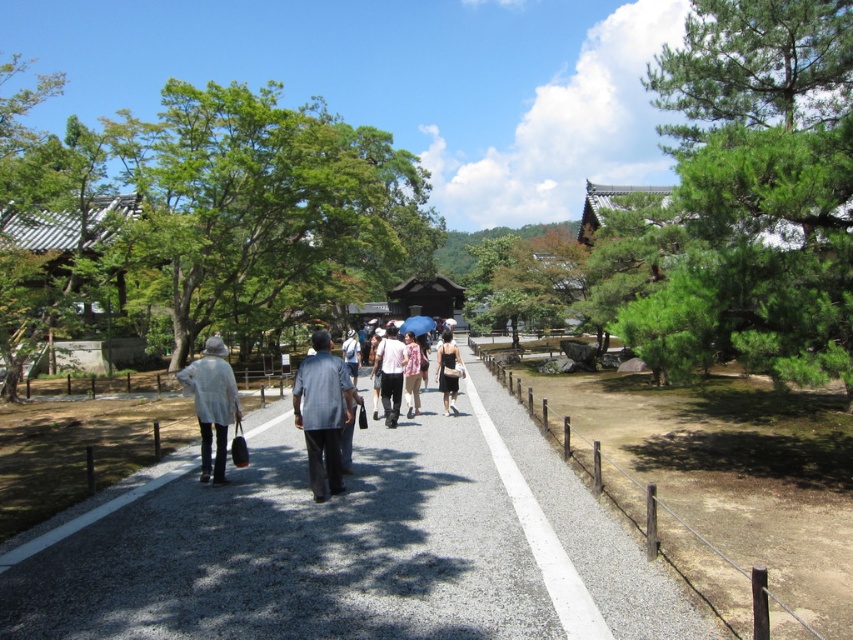
Who is higher up, black satin dress at center or blue fabric umbrella at center?

blue fabric umbrella at center

Is point (447, 376) closer to camera compared to point (428, 323)?

Yes.

Between point (454, 346) and point (419, 316), which one is positioned behind?

The point (419, 316) is more distant.

You are a GUI agent. You are given a task and a screenshot of the screen. Output one action in this format:
    pyautogui.click(x=<x>, y=<y>)
    Task: Click on the black satin dress at center
    
    Given the screenshot: What is the action you would take?
    pyautogui.click(x=447, y=371)

Which is in front, point (743, 317) or point (347, 356)?

Point (743, 317) is in front.

Who is higher up, green textured tree at upper right or light blue denim shirt at center?

Positioned higher is green textured tree at upper right.

What do you see at coordinates (746, 196) in the screenshot?
I see `green textured tree at upper right` at bounding box center [746, 196].

You are a GUI agent. You are given a task and a screenshot of the screen. Output one action in this format:
    pyautogui.click(x=<x>, y=<y>)
    Task: Click on the green textured tree at upper right
    The image size is (853, 640).
    Given the screenshot: What is the action you would take?
    pyautogui.click(x=746, y=196)

Can you confirm if blue fabric shirt at center is bigger than white cotton shirt at center?

Actually, blue fabric shirt at center might be smaller than white cotton shirt at center.

Measure the distance from blue fabric shirt at center to white cotton shirt at center.

The distance of blue fabric shirt at center from white cotton shirt at center is 13.42 feet.

What do you see at coordinates (322, 413) in the screenshot?
I see `blue fabric shirt at center` at bounding box center [322, 413].

This screenshot has height=640, width=853. Find the location of `blue fabric shirt at center`. blue fabric shirt at center is located at coordinates (322, 413).